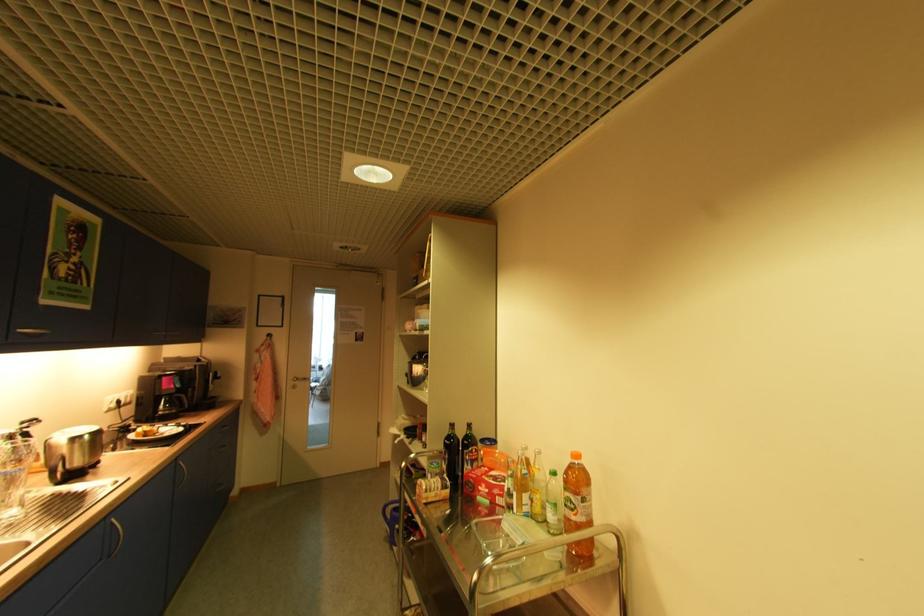
Where is `dark wine bottle`? Image resolution: width=924 pixels, height=616 pixels. dark wine bottle is located at coordinates (453, 463).